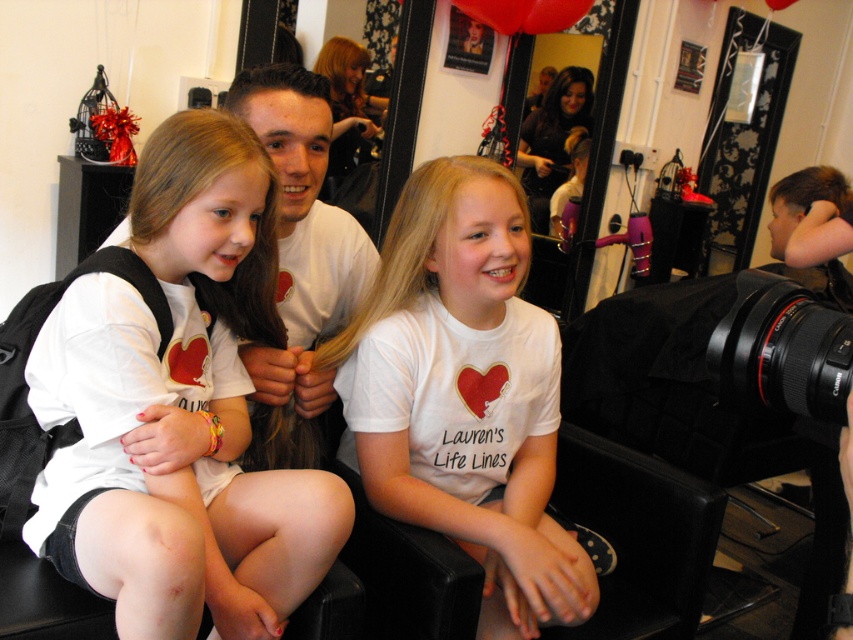
You are a stylist trying to decide which hairstyle to recommend between the blonde smooth hair at left and the dark brown hair at upper center. Which hairstyle has a larger volume?

The blonde smooth hair at left has a larger volume than the dark brown hair at upper center because it is bigger in size.

You are a customer standing at the entrance of the salon. You want to get your hair styled to match the person with blonde smooth hair at left. However, the stylist is currently attending to the person with dark brown hair at upper center. If the stylist moves at a speed of 1 meter per second, how many seconds will it take for them to reach you from their current position?

The blonde smooth hair at left is 3.33 meters from dark brown hair at upper center. Since the stylist is attending to the dark brown hair at upper center, they need to travel 3.33 meters to reach you. At a speed of 1 meter per second, it would take 3.33 seconds.